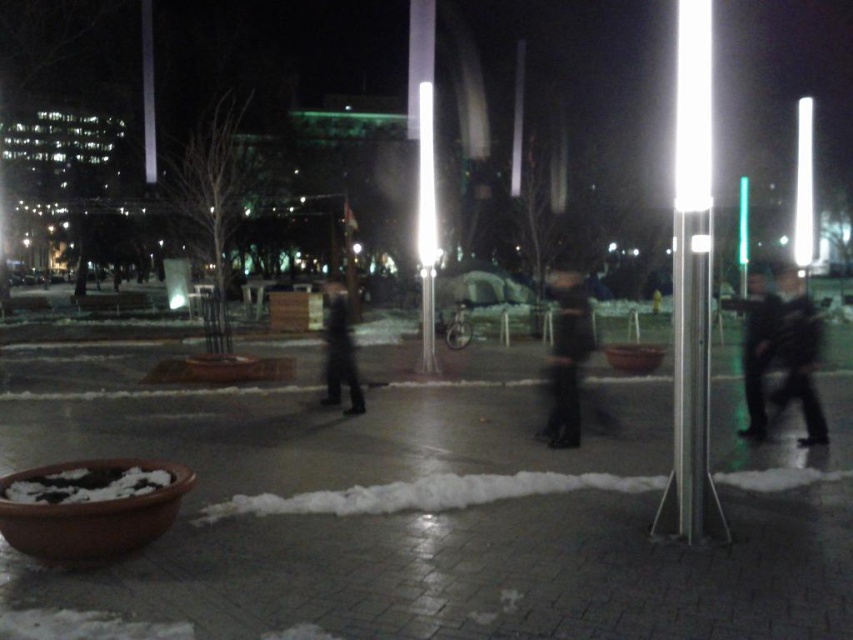
Does white glossy pole at right have a larger size compared to dark fabric jacket at right?

Yes, white glossy pole at right is bigger than dark fabric jacket at right.

Does point (708, 500) lie in front of point (746, 301)?

Yes, point (708, 500) is in front of point (746, 301).

Is point (683, 186) closer to camera compared to point (746, 348)?

Yes, it is.

At what (x,y) coordinates should I click in order to perform the action: click on white glossy pole at right. Please return your answer as a coordinate pair (x, y). The width and height of the screenshot is (853, 640). Looking at the image, I should click on (691, 288).

Can you confirm if dark gray fabric jacket at right is positioned to the right of dark blue fabric pants at center?

Correct, you'll find dark gray fabric jacket at right to the right of dark blue fabric pants at center.

Is point (796, 374) farther from viewer compared to point (564, 320)?

That is True.

This screenshot has width=853, height=640. In order to click on dark gray fabric jacket at right in this screenshot , I will do `click(798, 356)`.

Can you confirm if white glossy pole at right is smaller than dark blue fabric pants at center?

No, white glossy pole at right is not smaller than dark blue fabric pants at center.

Is white glossy pole at right further to camera compared to dark blue fabric pants at center?

No, white glossy pole at right is closer to the viewer.

Does point (704, 234) come closer to viewer compared to point (583, 305)?

Yes, it is in front of point (583, 305).

You are a GUI agent. You are given a task and a screenshot of the screen. Output one action in this format:
    pyautogui.click(x=<x>, y=<y>)
    Task: Click on the white glossy pole at right
    
    Given the screenshot: What is the action you would take?
    pyautogui.click(x=691, y=288)